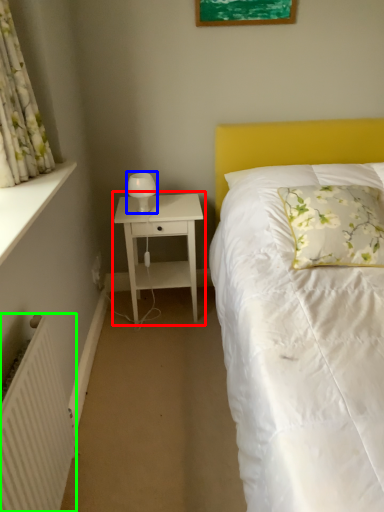
Question: Considering the real-world distances, which object is farthest from nightstand (highlighted by a red box)? bedside lamp (highlighted by a blue box) or radiator (highlighted by a green box)?

Choices:
 (A) bedside lamp
 (B) radiator

Answer: (B)